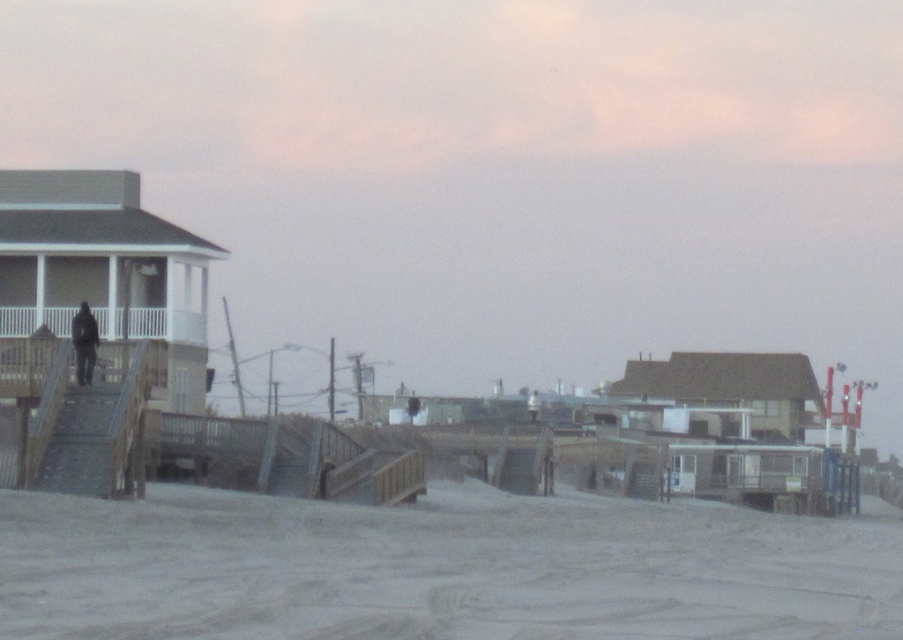
You are standing on the beach and see the metallic gray stairs at left and the dark gray fabric jacket at left. Which object is closer to the shore?

The metallic gray stairs at left is positioned under dark gray fabric jacket at left, which means the stairs are closer to the shore than the jacket.

You are standing at the center of the beach and want to reach the houses using the boardwalks. Which direction should you head towards from the metallic gray stairs at left to reach the nearest boardwalk?

The metallic gray stairs at left is located at point (81,444), so you should head towards the boardwalks which are in the midground leading up to the houses. Since the stairs are on the left side, heading right would direct you towards the nearest boardwalk.

You are standing on the sandy beach at lower left and want to walk to the dark gray fabric jacket at left. Is the jacket behind or in front of you?

The sandy beach at lower left is in front of the dark gray fabric jacket at left, so the jacket is behind you.